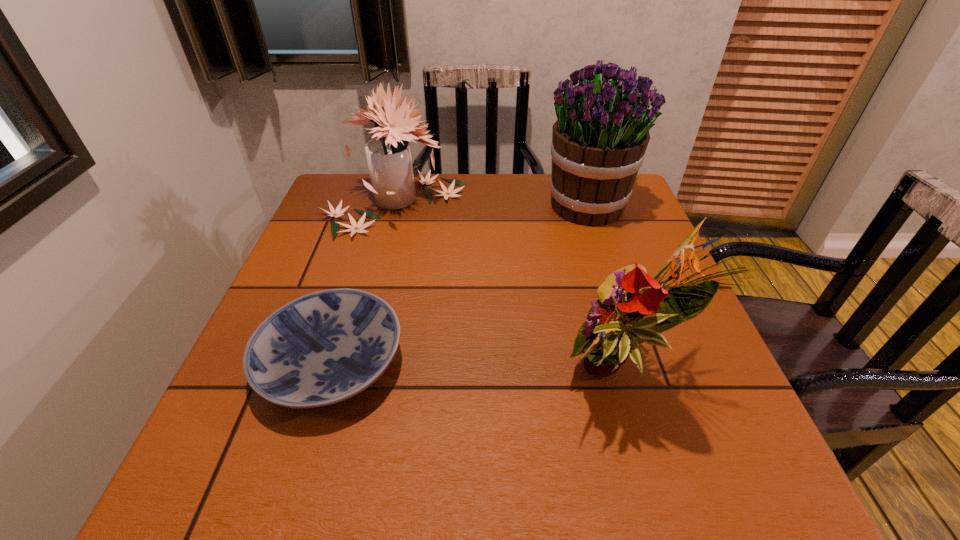
What are the coordinates of `object that is the third closest one to the plate` in the screenshot? It's located at (599, 140).

Locate an element on the screen. bouquet that is the second nearest to the plate is located at coordinates (632, 308).

Point out which bouquet is positioned as the third nearest to the plate. Please provide its 2D coordinates. Your answer should be formatted as a tuple, i.e. [(x, y)], where the tuple contains the x and y coordinates of a point satisfying the conditions above.

[(599, 140)]

Find the location of a particular element. vacant region that satisfies the following two spatial constraints: 1. on the front side of the tallest bouquet; 2. on the front-facing side of the nearest bouquet is located at coordinates (644, 376).

Find the location of a particular element. vacant space that satisfies the following two spatial constraints: 1. on the front side of the tallest object; 2. on the front-facing side of the nearest bouquet is located at coordinates (644, 376).